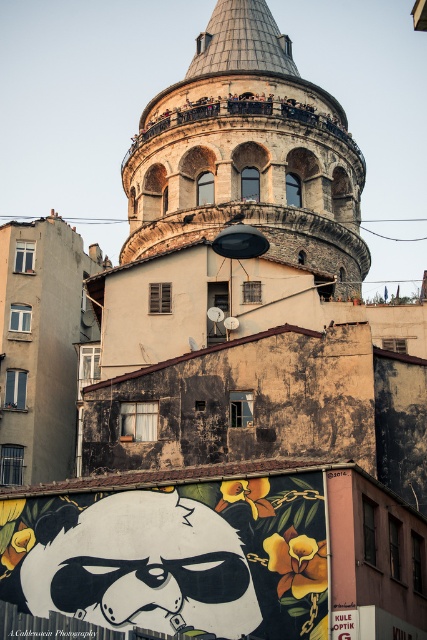
Can you confirm if black glossy panda at lower center is positioned to the right of stone tower at center?

In fact, black glossy panda at lower center is to the left of stone tower at center.

Who is shorter, black glossy panda at lower center or stone tower at center?

Standing shorter between the two is black glossy panda at lower center.

Which is behind, point (20, 518) or point (322, 131)?

The point (322, 131) is more distant.

Identify the location of black glossy panda at lower center. (175, 556).